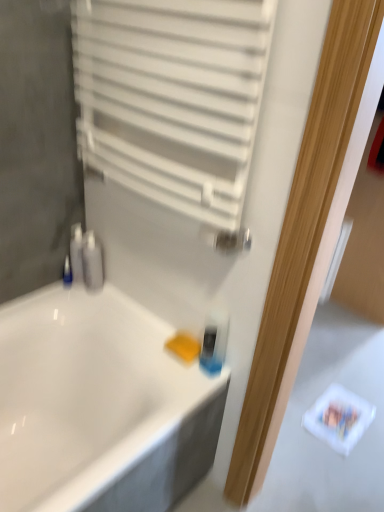
Question: From a real-world perspective, does blue plastic bottle at left, which is the first toiletry in left-to-right order, stand above yellow sponge at lower center?

Choices:
 (A) yes
 (B) no

Answer: (A)

Question: From the image's perspective, is blue plastic bottle at left, which is the first toiletry in left-to-right order, located beneath yellow sponge at lower center?

Choices:
 (A) no
 (B) yes

Answer: (A)

Question: From a real-world perspective, is blue plastic bottle at left, which appears as the 2th toiletry when viewed from the right, below yellow sponge at lower center?

Choices:
 (A) yes
 (B) no

Answer: (B)

Question: Is blue plastic bottle at left, which is the first toiletry in left-to-right order, thinner than yellow sponge at lower center?

Choices:
 (A) yes
 (B) no

Answer: (A)

Question: Does blue plastic bottle at left, which appears as the 2th toiletry when viewed from the right, come behind yellow sponge at lower center?

Choices:
 (A) yes
 (B) no

Answer: (A)

Question: Considering the relative sizes of blue plastic bottle at left, which is the first toiletry in left-to-right order, and yellow sponge at lower center in the image provided, is blue plastic bottle at left, which is the first toiletry in left-to-right order, wider than yellow sponge at lower center?

Choices:
 (A) yes
 (B) no

Answer: (B)

Question: From a real-world perspective, is white matte radiator at upper center physically below yellow sponge at lower center?

Choices:
 (A) no
 (B) yes

Answer: (A)

Question: Is white matte radiator at upper center turned away from yellow sponge at lower center?

Choices:
 (A) no
 (B) yes

Answer: (A)

Question: Is white matte radiator at upper center in contact with yellow sponge at lower center?

Choices:
 (A) no
 (B) yes

Answer: (A)

Question: Can you confirm if white matte radiator at upper center is thinner than yellow sponge at lower center?

Choices:
 (A) yes
 (B) no

Answer: (B)

Question: Is white matte radiator at upper center at the left side of yellow sponge at lower center?

Choices:
 (A) yes
 (B) no

Answer: (A)

Question: From the image's perspective, would you say white matte radiator at upper center is shown under yellow sponge at lower center?

Choices:
 (A) yes
 (B) no

Answer: (B)

Question: Considering the relative positions of white glossy bathtub at center and white matte radiator at upper center in the image provided, is white glossy bathtub at center to the left of white matte radiator at upper center from the viewer's perspective?

Choices:
 (A) yes
 (B) no

Answer: (A)